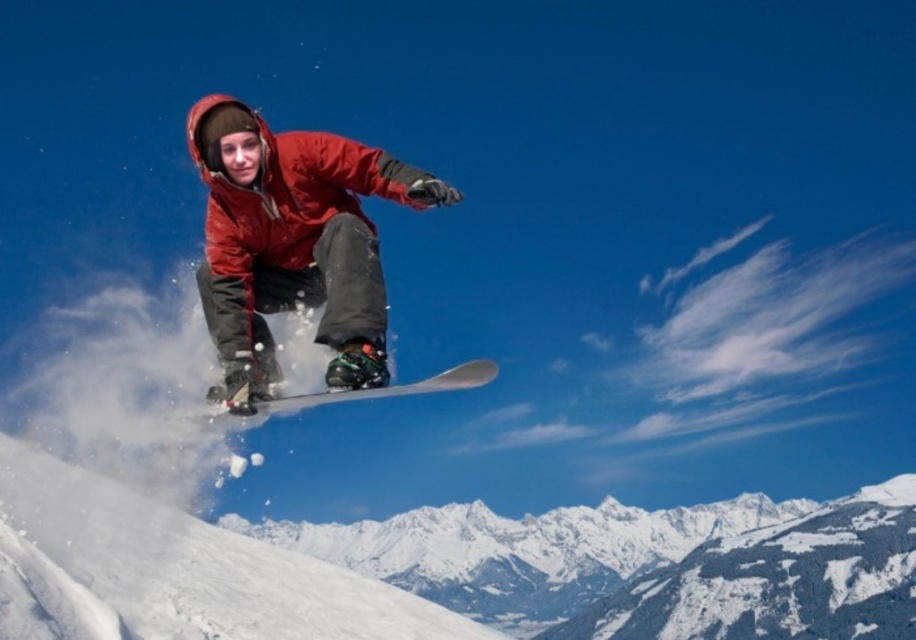
Is matte red snowboarder at center bigger than white glossy snowboard at center?

Yes.

The width and height of the screenshot is (916, 640). Describe the element at coordinates (300, 253) in the screenshot. I see `matte red snowboarder at center` at that location.

Between point (224, 269) and point (439, 380), which one is positioned behind?

The point (439, 380) is behind.

Identify the location of matte red snowboarder at center. (300, 253).